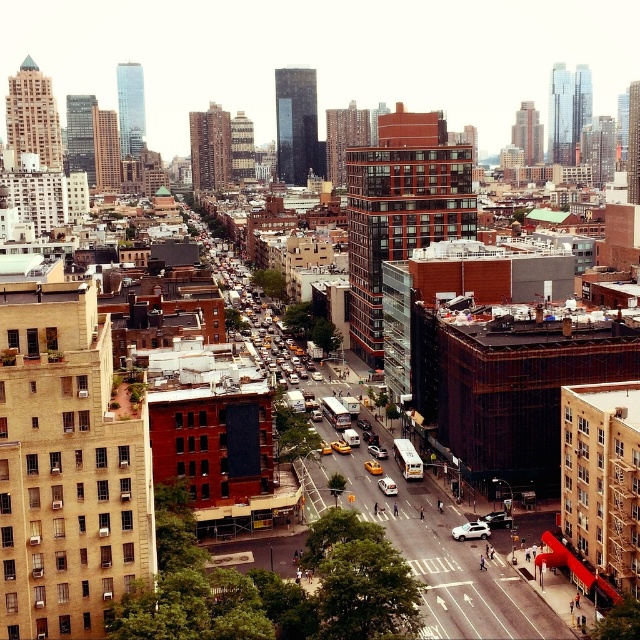
You are a delivery drone operator who needs to fly a package between the white matte car at center and the white glossy car at center. The drone has a maximum flight distance of 50 feet. Can the drone safely deliver the package without exceeding its range?

The distance between the white matte car at center and the white glossy car at center is 54.77 feet, which exceeds the drone operator maximum flight distance of 50 feet. Therefore, the drone cannot safely deliver the package without exceeding its range.

You are a drone operator who needs to deliver a package to a white matte car at center located in a busy city. The drone has a maximum delivery range of 100 meters. Can the drone reach the car?

The white matte car at center is 114.40 meters from the camera, which exceeds the drone delivery range of 100 meters. The drone cannot reach the car.

You are a city planner analyzing traffic flow. You observe two cars, the white matte car at center and the white glossy car at center. Which car has a narrower width?

The white matte car at center is thinner than the white glossy car at center, so the white matte car at center has a narrower width.